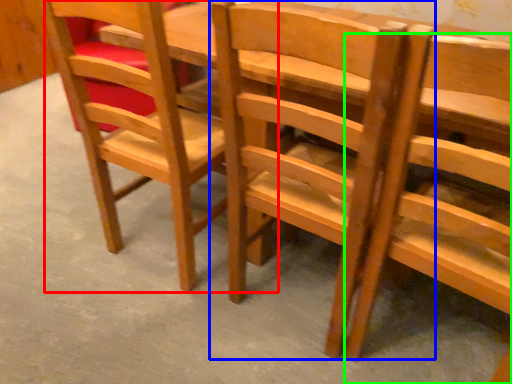
Question: Estimate the real-world distances between objects in this image. Which object is closer to chair (highlighted by a red box), chair (highlighted by a blue box) or chair (highlighted by a green box)?

Choices:
 (A) chair
 (B) chair

Answer: (A)